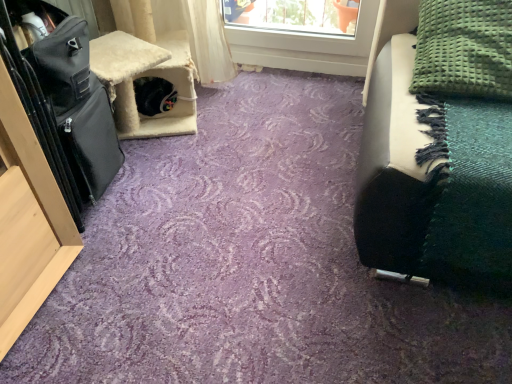
Question: Is green textured blanket at upper right to the right of black leather suitcase at left from the viewer's perspective?

Choices:
 (A) no
 (B) yes

Answer: (B)

Question: Is green textured blanket at upper right not inside black leather suitcase at left?

Choices:
 (A) yes
 (B) no

Answer: (A)

Question: Can you confirm if green textured blanket at upper right is bigger than black leather suitcase at left?

Choices:
 (A) yes
 (B) no

Answer: (B)

Question: From a real-world perspective, is green textured blanket at upper right on top of black leather suitcase at left?

Choices:
 (A) yes
 (B) no

Answer: (A)

Question: Does green textured blanket at upper right have a lesser height compared to black leather suitcase at left?

Choices:
 (A) no
 (B) yes

Answer: (B)

Question: Considering the relative positions of green textured blanket at upper right and black leather suitcase at left in the image provided, is green textured blanket at upper right in front of black leather suitcase at left?

Choices:
 (A) no
 (B) yes

Answer: (A)

Question: Is black leather suitcase at left thinner than green textured blanket at upper right?

Choices:
 (A) no
 (B) yes

Answer: (A)

Question: Is black leather suitcase at left positioned beyond the bounds of green textured blanket at upper right?

Choices:
 (A) no
 (B) yes

Answer: (B)

Question: From the image's perspective, is black leather suitcase at left under green textured blanket at upper right?

Choices:
 (A) yes
 (B) no

Answer: (A)

Question: Can you confirm if black leather suitcase at left is smaller than green textured blanket at upper right?

Choices:
 (A) yes
 (B) no

Answer: (B)

Question: Is the surface of black leather suitcase at left in direct contact with green textured blanket at upper right?

Choices:
 (A) yes
 (B) no

Answer: (B)

Question: Would you say green textured blanket at upper right is part of black leather suitcase at left's contents?

Choices:
 (A) yes
 (B) no

Answer: (B)

Question: Relative to black leather suitcase at left, is green textured blanket at upper right in front or behind?

Choices:
 (A) behind
 (B) front

Answer: (A)